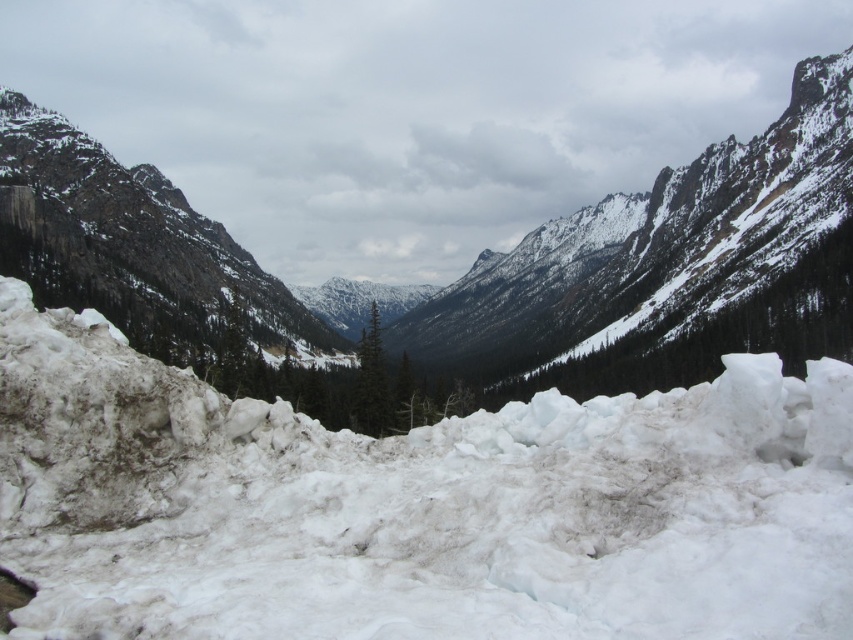
Question: Is white frosty snow at center to the right of snowy rock at lower left from the viewer's perspective?

Choices:
 (A) yes
 (B) no

Answer: (B)

Question: Among these objects, which one is nearest to the camera?

Choices:
 (A) white frosty snow at center
 (B) snowy rock at lower left

Answer: (A)

Question: Is white frosty snow at center smaller than snowy rock at lower left?

Choices:
 (A) no
 (B) yes

Answer: (B)

Question: Is white frosty snow at center positioned at the back of snowy rock at lower left?

Choices:
 (A) yes
 (B) no

Answer: (B)

Question: Which point is closer to the camera?

Choices:
 (A) white frosty snow at center
 (B) snowy rock at lower left

Answer: (A)

Question: Which point appears closest to the camera in this image?

Choices:
 (A) (633, 248)
 (B) (659, 512)

Answer: (B)